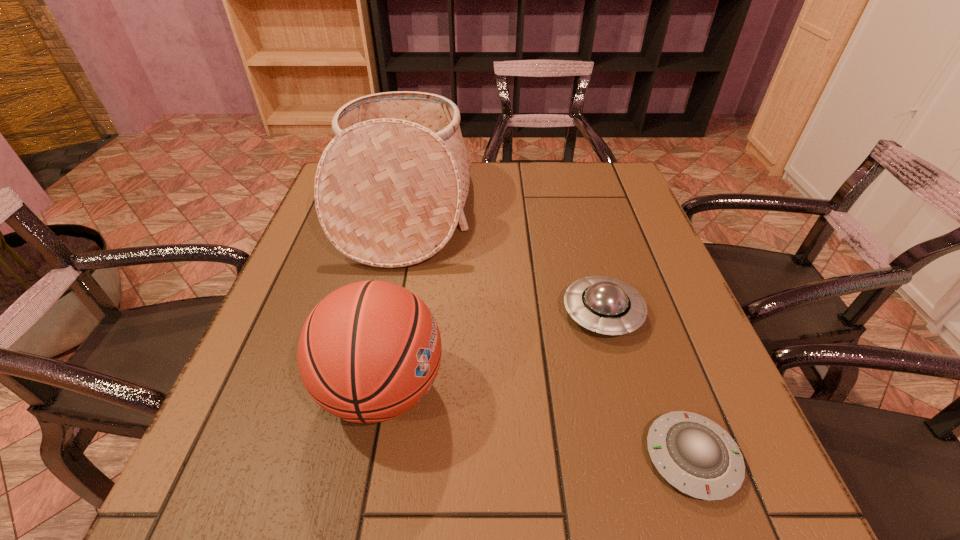
Identify which object is the third closest to the basketball. Please provide its 2D coordinates. Your answer should be formatted as a tuple, i.e. [(x, y)], where the tuple contains the x and y coordinates of a point satisfying the conditions above.

[(695, 455)]

I want to click on free space that satisfies the following two spatial constraints: 1. with the lid open on the tallest object; 2. on the left side of the shortest object, so click(348, 457).

Image resolution: width=960 pixels, height=540 pixels. Identify the location of vacant position in the image that satisfies the following two spatial constraints: 1. on the logo side of the nearer saucer; 2. on the right side of the basketball. (370, 457).

Find the location of a particular element. The height and width of the screenshot is (540, 960). vacant space that satisfies the following two spatial constraints: 1. on the logo side of the second tallest object; 2. on the left side of the shortest object is located at coordinates (370, 457).

What are the coordinates of `vacant region that satisfies the following two spatial constraints: 1. on the back side of the shorter saucer; 2. on the logo side of the third shortest object` in the screenshot? It's located at (667, 389).

The image size is (960, 540). Identify the location of vacant space that satisfies the following two spatial constraints: 1. on the front side of the third tallest object; 2. on the logo side of the basketball. (623, 389).

You are a GUI agent. You are given a task and a screenshot of the screen. Output one action in this format:
    pyautogui.click(x=<x>, y=<y>)
    Task: Click on the vacant space that satisfies the following two spatial constraints: 1. on the front side of the taller saucer; 2. on the logo side of the basketball
    
    Given the screenshot: What is the action you would take?
    pyautogui.click(x=623, y=389)

Where is `free space that satisfies the following two spatial constraints: 1. on the logo side of the third shortest object; 2. on the back side of the shorter saucer`? This screenshot has height=540, width=960. free space that satisfies the following two spatial constraints: 1. on the logo side of the third shortest object; 2. on the back side of the shorter saucer is located at coordinates (x=370, y=457).